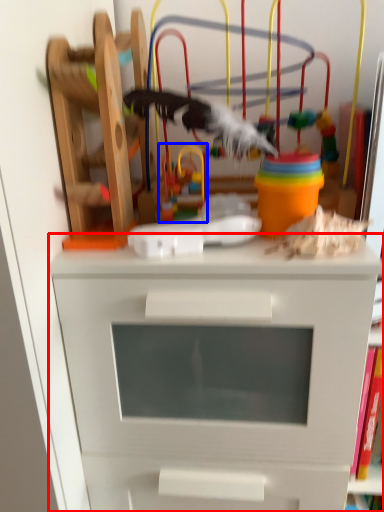
Question: Which object appears farthest to the camera in this image, chest of drawers (highlighted by a red box) or toy (highlighted by a blue box)?

Choices:
 (A) chest of drawers
 (B) toy

Answer: (B)